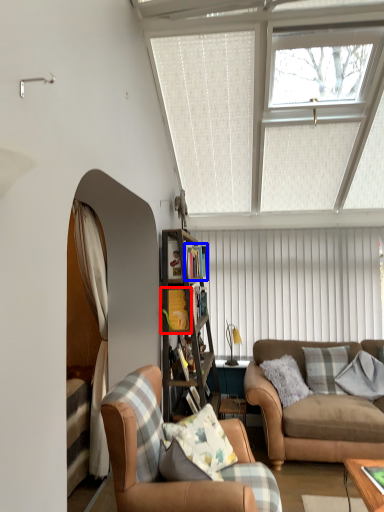
Question: Which object is closer to the camera taking this photo, shelf (highlighted by a red box) or shelf (highlighted by a blue box)?

Choices:
 (A) shelf
 (B) shelf

Answer: (A)